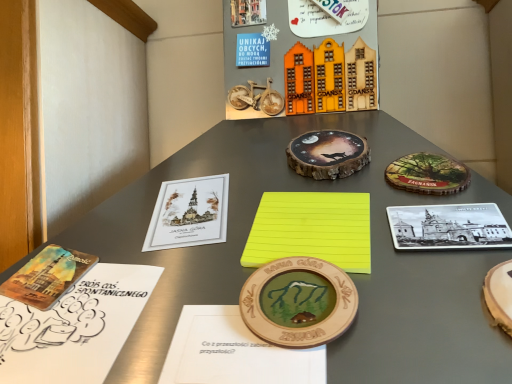
Question: Can you confirm if yellow matte paper at center is positioned to the right of yellow paper at center, arranged as the 1th notebook when viewed from the right?

Choices:
 (A) no
 (B) yes

Answer: (A)

Question: Can you confirm if yellow matte paper at center is wider than yellow paper at center, arranged as the 1th notebook when viewed from the right?

Choices:
 (A) yes
 (B) no

Answer: (A)

Question: Can you confirm if yellow matte paper at center is bigger than yellow paper at center, arranged as the 1th notebook when viewed from the right?

Choices:
 (A) yes
 (B) no

Answer: (A)

Question: Is yellow matte paper at center with yellow paper at center, acting as the third notebook starting from the left?

Choices:
 (A) no
 (B) yes

Answer: (B)

Question: Is yellow matte paper at center smaller than yellow paper at center, arranged as the 1th notebook when viewed from the right?

Choices:
 (A) yes
 (B) no

Answer: (B)

Question: Considering the positions of watercolor paper book at lower left, the third book viewed from the right, and matte paper book at center left, the second book when ordered from right to left, in the image, is watercolor paper book at lower left, the third book viewed from the right, taller or shorter than matte paper book at center left, the second book when ordered from right to left,?

Choices:
 (A) tall
 (B) short

Answer: (B)

Question: Considering the positions of point click(61, 249) and point click(194, 221), is point click(61, 249) closer or farther from the camera than point click(194, 221)?

Choices:
 (A) closer
 (B) farther

Answer: (A)

Question: Is watercolor paper book at lower left, arranged as the 1th book when viewed from the left, to the left or to the right of matte paper book at center left, the second book when ordered from right to left, in the image?

Choices:
 (A) left
 (B) right

Answer: (A)

Question: From a real-world perspective, is watercolor paper book at lower left, the third book viewed from the right, physically located above or below matte paper book at center left, placed as the second book when sorted from left to right?

Choices:
 (A) above
 (B) below

Answer: (B)

Question: In the image, is wooden medallion at center, the 1th coin when ordered from front to back, positioned in front of or behind watercolor paper book at lower left, the third book viewed from the right?

Choices:
 (A) front
 (B) behind

Answer: (A)

Question: Based on their sizes in the image, would you say wooden medallion at center, the second coin from the top, is bigger or smaller than watercolor paper book at lower left, arranged as the 1th book when viewed from the left?

Choices:
 (A) big
 (B) small

Answer: (A)

Question: From a real-world perspective, relative to watercolor paper book at lower left, arranged as the 1th book when viewed from the left, is wooden medallion at center, the second coin from the top, vertically above or below?

Choices:
 (A) below
 (B) above

Answer: (A)

Question: Is wooden medallion at center, the second coin from the top, spatially inside watercolor paper book at lower left, arranged as the 1th book when viewed from the left, or outside of it?

Choices:
 (A) inside
 (B) outside

Answer: (B)

Question: Considering the positions of matte paper book at center left, placed as the second book when sorted from left to right, and white paper notebook at lower left, the 1th notebook when ordered from left to right, in the image, is matte paper book at center left, placed as the second book when sorted from left to right, taller or shorter than white paper notebook at lower left, the 1th notebook when ordered from left to right,?

Choices:
 (A) tall
 (B) short

Answer: (A)

Question: In terms of size, does matte paper book at center left, the second book when ordered from right to left, appear bigger or smaller than white paper notebook at lower left, acting as the third notebook starting from the right?

Choices:
 (A) big
 (B) small

Answer: (B)